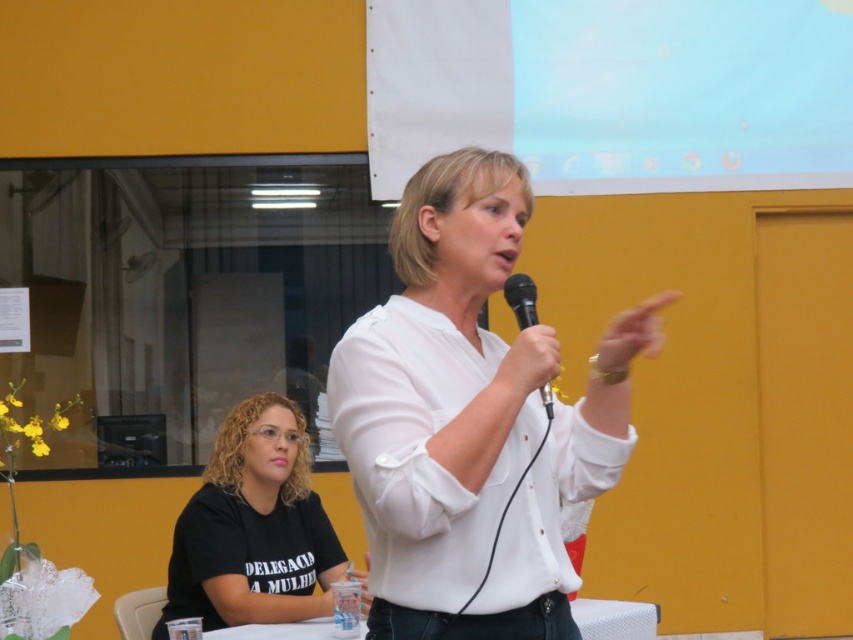
Question: Can you confirm if black matte shirt at lower left is positioned below black matte microphone at center?

Choices:
 (A) yes
 (B) no

Answer: (A)

Question: Which object is farther from the camera taking this photo?

Choices:
 (A) black matte microphone at center
 (B) white matte shirt at center
 (C) black matte shirt at lower left
 (D) white plastic table at lower center

Answer: (D)

Question: Does white plastic table at lower center appear under black matte microphone at center?

Choices:
 (A) yes
 (B) no

Answer: (A)

Question: Which of these objects is positioned closest to the black matte microphone at center?

Choices:
 (A) white matte shirt at center
 (B) black matte shirt at lower left
 (C) white plastic table at lower center

Answer: (A)

Question: Among these points, which one is farthest from the camera?

Choices:
 (A) (593, 436)
 (B) (518, 301)
 (C) (323, 540)

Answer: (C)

Question: Does white matte shirt at center have a greater width compared to white plastic table at lower center?

Choices:
 (A) yes
 (B) no

Answer: (A)